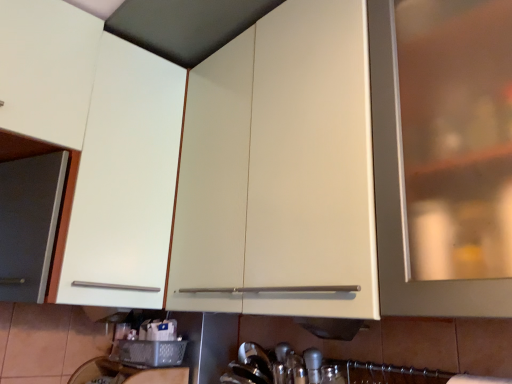
Question: Visually, is matte white cabinet at center, which is the second cabinetry in left-to-right order, positioned to the left or to the right of matte white cabinet at left, the 1th cabinetry positioned from the left?

Choices:
 (A) left
 (B) right

Answer: (B)

Question: Is matte white cabinet at center, the 1th cabinetry positioned from the right, taller or shorter than matte white cabinet at left, the 1th cabinetry positioned from the left?

Choices:
 (A) short
 (B) tall

Answer: (A)

Question: Looking at their shapes, would you say matte white cabinet at center, the 1th cabinetry positioned from the right, is wider or thinner than matte white cabinet at left, the 2th cabinetry positioned from the right?

Choices:
 (A) wide
 (B) thin

Answer: (B)

Question: In terms of height, does matte white cabinet at left, the 2th cabinetry positioned from the right, look taller or shorter compared to matte white cabinet at center, the 1th cabinetry positioned from the right?

Choices:
 (A) tall
 (B) short

Answer: (A)

Question: Would you say matte white cabinet at left, the 1th cabinetry positioned from the left, is inside or outside matte white cabinet at center, the 1th cabinetry positioned from the right?

Choices:
 (A) inside
 (B) outside

Answer: (B)

Question: From a real-world perspective, is matte white cabinet at left, the 2th cabinetry positioned from the right, physically located above or below matte white cabinet at center, the 1th cabinetry positioned from the right?

Choices:
 (A) above
 (B) below

Answer: (A)

Question: Is matte white cabinet at left, the 1th cabinetry positioned from the left, bigger or smaller than matte white cabinet at center, which is the second cabinetry in left-to-right order?

Choices:
 (A) small
 (B) big

Answer: (A)